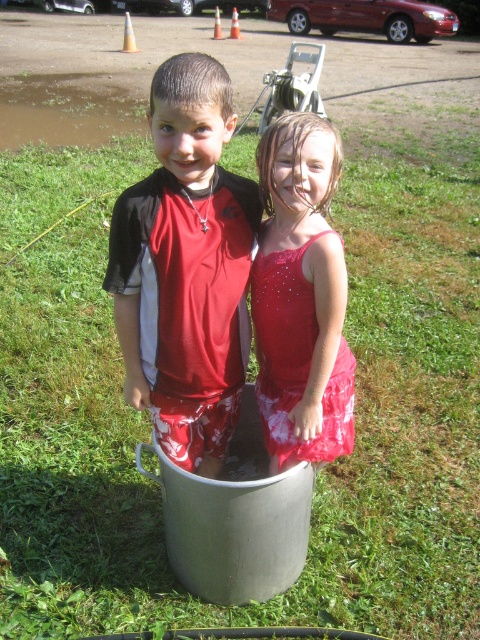
Based on the photo, between matte red shirt at center and sparkly red dress at center, which one is positioned lower?

Positioned lower is sparkly red dress at center.

Which of these two, matte red shirt at center or sparkly red dress at center, stands taller?

With more height is matte red shirt at center.

You are a GUI agent. You are given a task and a screenshot of the screen. Output one action in this format:
    pyautogui.click(x=<x>, y=<y>)
    Task: Click on the matte red shirt at center
    
    Given the screenshot: What is the action you would take?
    pos(186,268)